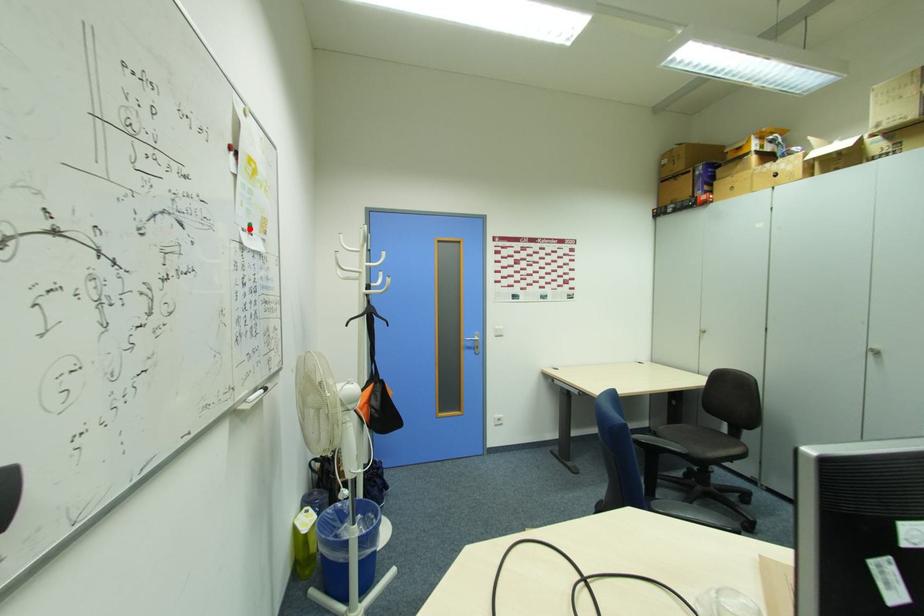
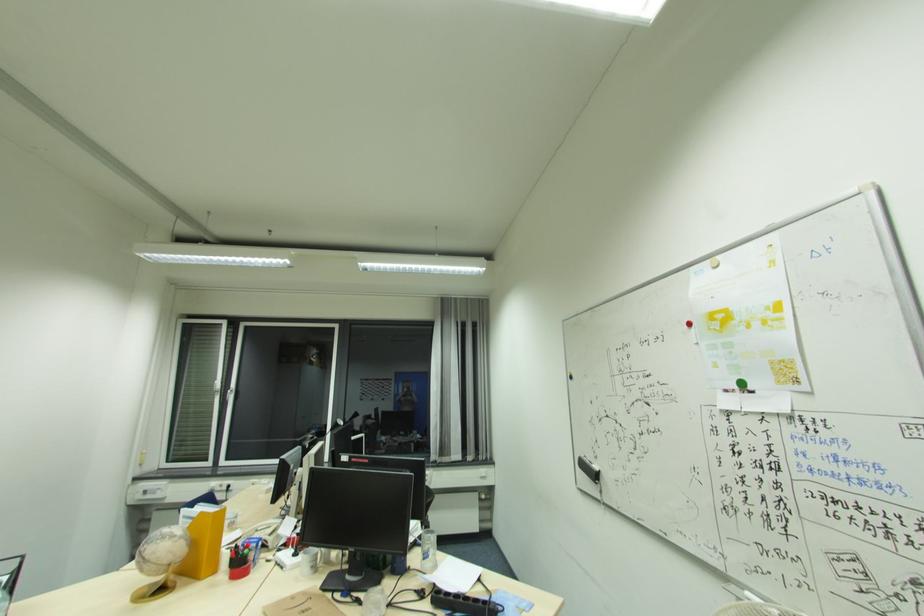
The point at the highlighted location is marked in the first image. Where is the corresponding point in the second image?

(739, 387)